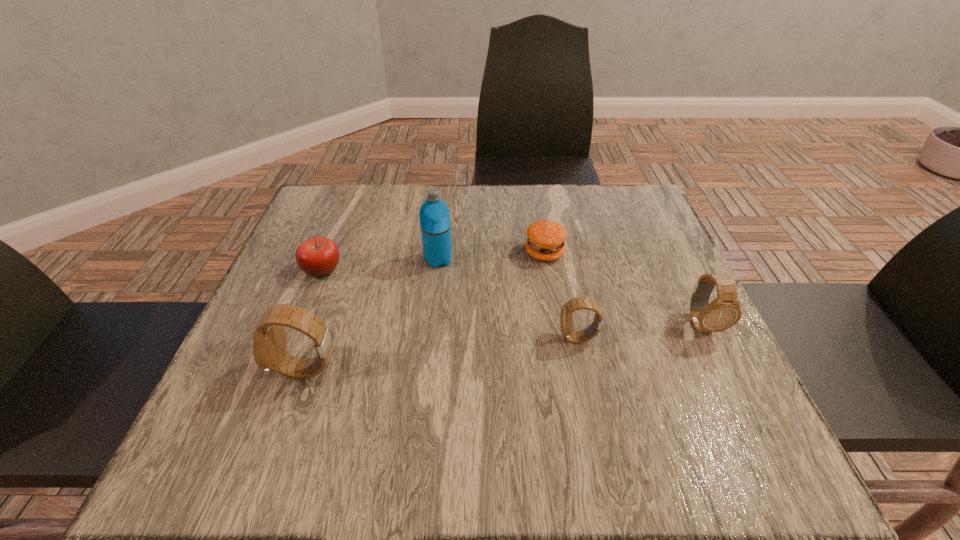
Please point a space for a new watch to maintain equal intervals. Please provide its 2D coordinates. Your answer should be formatted as a tuple, i.e. [(x, y)], where the tuple contains the x and y coordinates of a point satisfying the conditions above.

[(447, 354)]